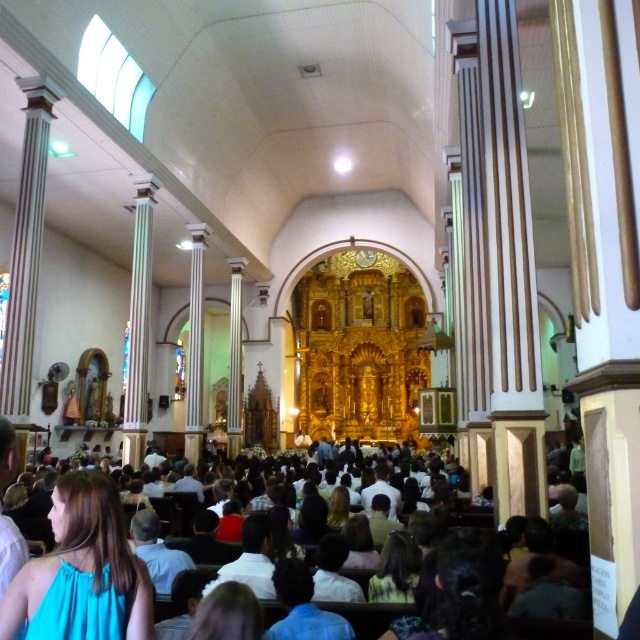
Question: Considering the relative positions of white clothed crowd at center and teal fabric dress at lower left in the image provided, where is white clothed crowd at center located with respect to teal fabric dress at lower left?

Choices:
 (A) left
 (B) right

Answer: (B)

Question: Which point is closer to the camera taking this photo?

Choices:
 (A) (68, 556)
 (B) (81, 518)

Answer: (A)

Question: Does white clothed crowd at center have a lesser width compared to teal fabric dress at lower left?

Choices:
 (A) no
 (B) yes

Answer: (A)

Question: Can you confirm if white clothed crowd at center is positioned above teal fabric dress at lower left?

Choices:
 (A) yes
 (B) no

Answer: (B)